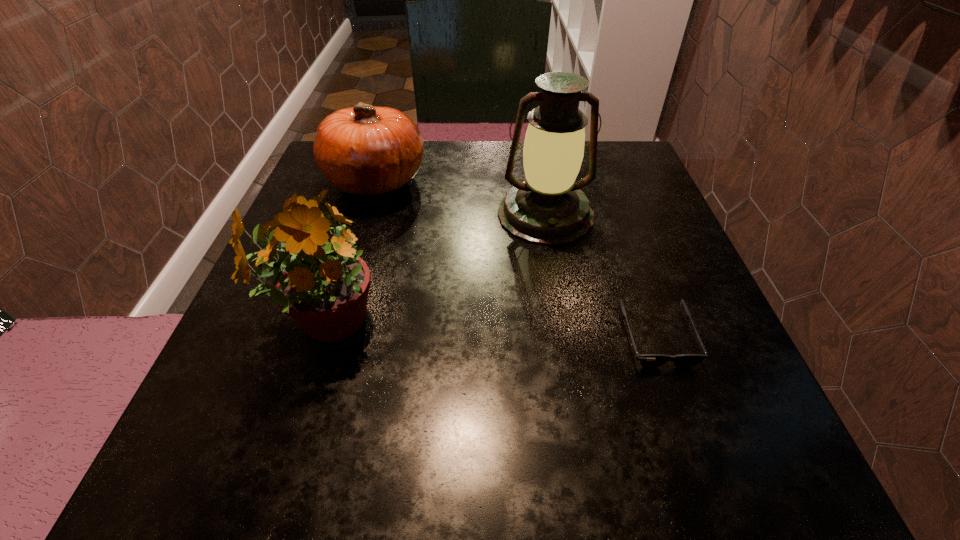
What are the coordinates of `flowerpot located in the left edge section of the desktop` in the screenshot? It's located at (320, 281).

You are a GUI agent. You are given a task and a screenshot of the screen. Output one action in this format:
    pyautogui.click(x=<x>, y=<y>)
    Task: Click on the pumpkin situated at the left edge
    The image size is (960, 540).
    Given the screenshot: What is the action you would take?
    pyautogui.click(x=365, y=150)

Locate an element on the screen. The image size is (960, 540). lantern present at the right edge is located at coordinates (548, 208).

Locate an element on the screen. Image resolution: width=960 pixels, height=540 pixels. sunglasses at the right edge is located at coordinates (646, 360).

Find the location of `object located at the far left corner`. object located at the far left corner is located at coordinates (365, 150).

The width and height of the screenshot is (960, 540). Find the location of `object positioned at the far right corner`. object positioned at the far right corner is located at coordinates (548, 208).

The image size is (960, 540). I want to click on vacant region at the far edge, so click(x=475, y=148).

This screenshot has width=960, height=540. I want to click on free space at the near edge of the desktop, so click(437, 463).

In the image, there is a desktop. Identify the location of vacant space at the left edge. Image resolution: width=960 pixels, height=540 pixels. (291, 323).

At what (x,y) coordinates should I click in order to perform the action: click on free space at the right edge of the desktop. Please return your answer as a coordinate pair (x, y). The height and width of the screenshot is (540, 960). Looking at the image, I should click on (695, 278).